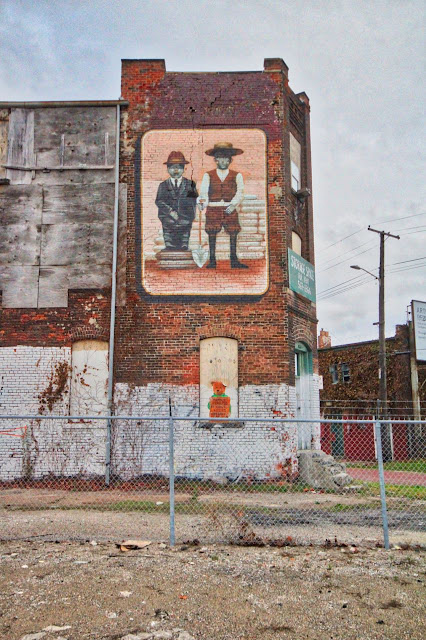
This screenshot has height=640, width=426. Find the location of `door`. door is located at coordinates (298, 386).